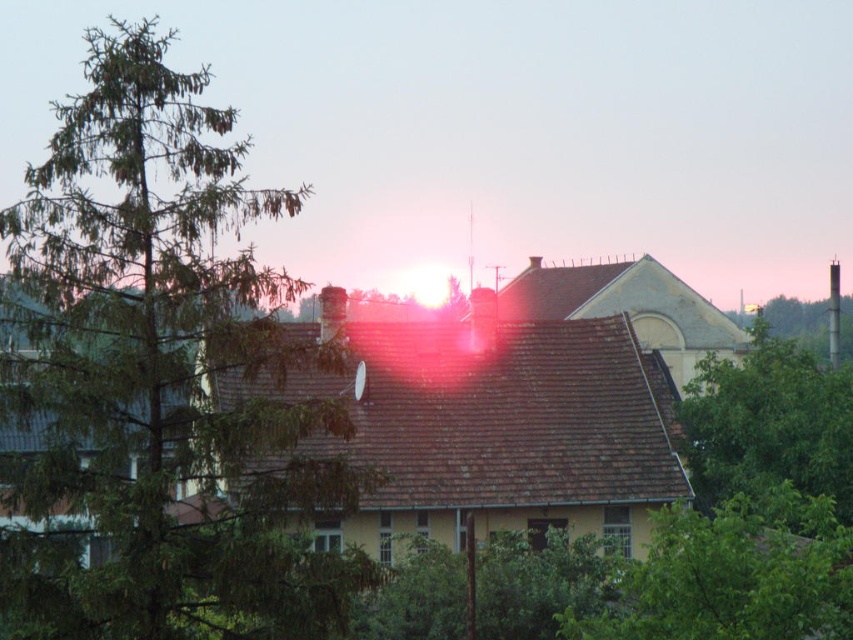
Question: Which point is farther to the camera?

Choices:
 (A) (601, 557)
 (B) (0, 550)

Answer: (A)

Question: Can you confirm if green leafy tree at lower right is positioned to the right of green leafy tree at center?

Choices:
 (A) yes
 (B) no

Answer: (A)

Question: Estimate the real-world distances between objects in this image. Which object is farther from the green leafy tree at lower right?

Choices:
 (A) green leafy tree at left
 (B) green leafy tree at center

Answer: (A)

Question: From the image, what is the correct spatial relationship of green leafy tree at left in relation to green leafy tree at lower right?

Choices:
 (A) right
 (B) left

Answer: (B)

Question: Is green leafy tree at left above green leafy tree at right?

Choices:
 (A) yes
 (B) no

Answer: (A)

Question: Which object is farther from the camera taking this photo?

Choices:
 (A) green leafy tree at right
 (B) green leafy tree at center
 (C) green leafy tree at lower right

Answer: (A)